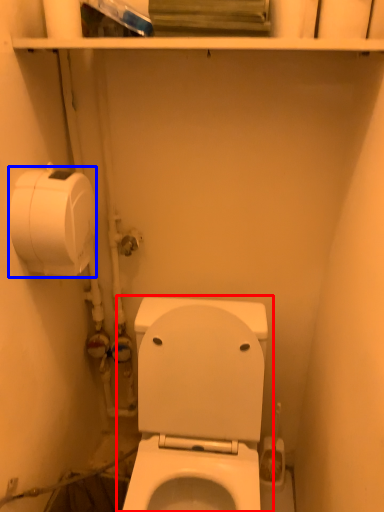
Question: Among these objects, which one is nearest to the camera, toilet (highlighted by a red box) or toilet paper (highlighted by a blue box)?

Choices:
 (A) toilet
 (B) toilet paper

Answer: (A)